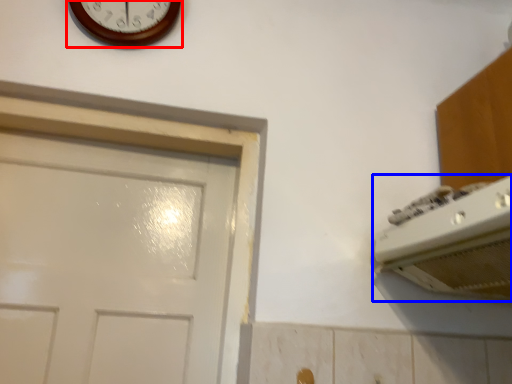
Question: Which of the following is the farthest to the observer, wall clock (highlighted by a red box) or appliance (highlighted by a blue box)?

Choices:
 (A) wall clock
 (B) appliance

Answer: (A)